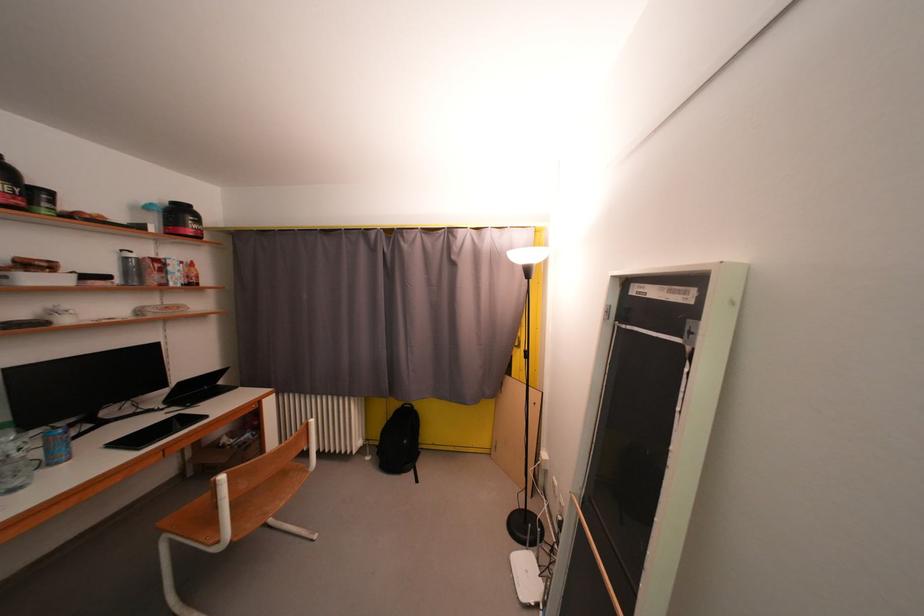
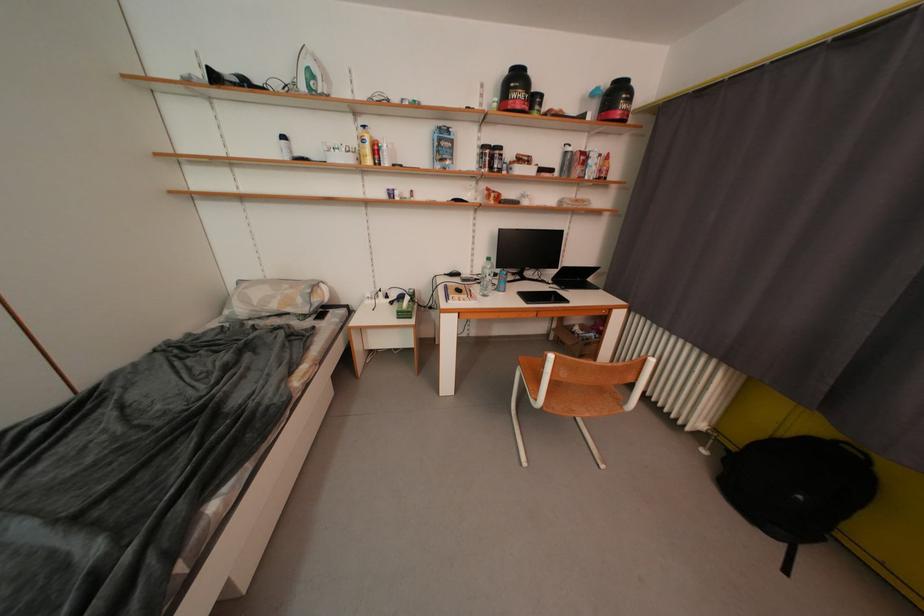
The first image is from the beginning of the video and the second image is from the end. How did the camera likely rotate when shooting the video?

The camera rotated toward left-down.